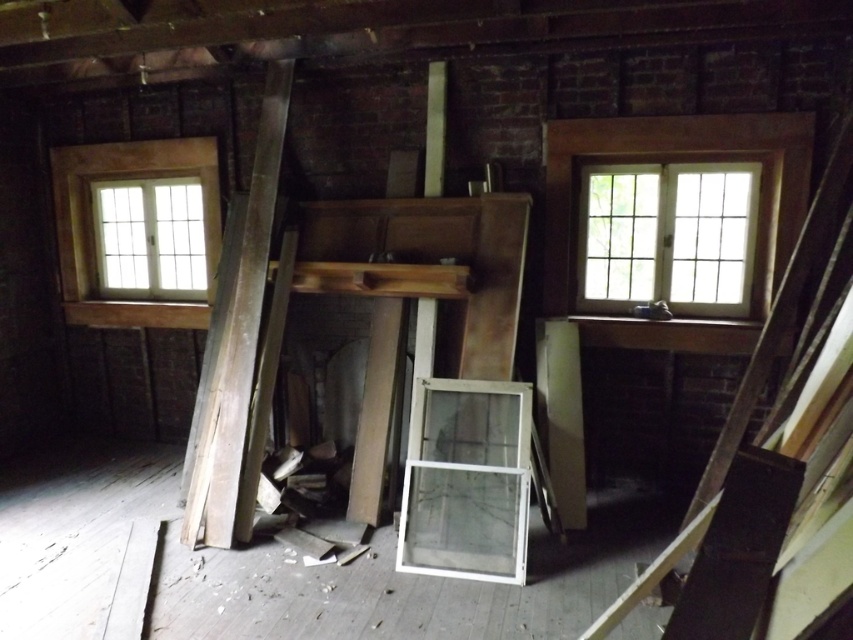
You are a carpenter trying to decide whether to use the weathered wood beam at left or the clear glass window at left for a project that requires a larger material. Based on the scene, which object should you choose?

The weathered wood beam at left is bigger than the clear glass window at left, so you should choose the weathered wood beam at left for your project.

You are standing in the center of the room. There is a wooden at right at point (750, 452). Where is the wooden at right located relative to your position?

The wooden at right is located at point (750, 452), which is to the right side of the room from your central position.

You are an inspector checking the structural integrity of this old building. You notice the clear glass window at upper right and the weathered wood beam at left. Which object would you prioritize inspecting first based on their sizes?

The weathered wood beam at left should be inspected first because it is larger than the clear glass window at upper right, making it potentially more critical for structural support.